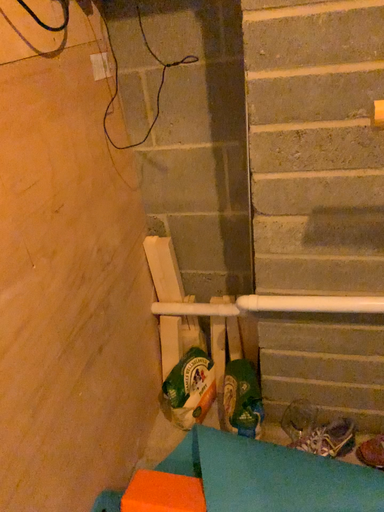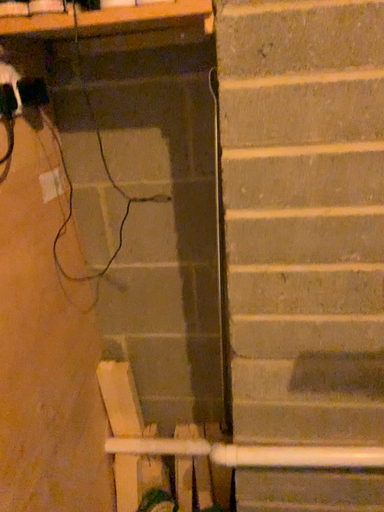
Question: Which way did the camera rotate in the video?

Choices:
 (A) rotated left
 (B) rotated right

Answer: (B)